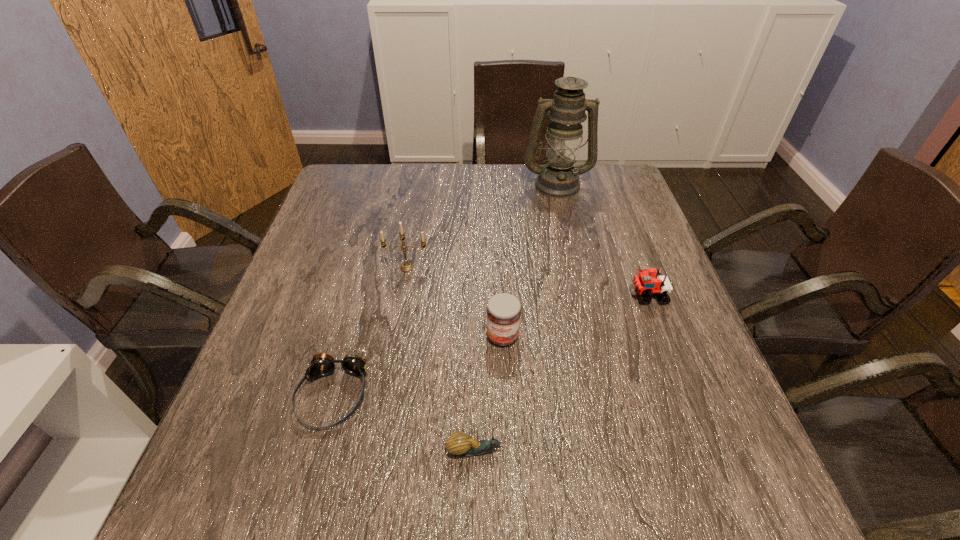
Find the location of `oil lamp located at the right edge`. oil lamp located at the right edge is located at coordinates (559, 178).

Locate an element on the screen. Image resolution: width=960 pixels, height=540 pixels. Lego at the right edge is located at coordinates (644, 284).

Image resolution: width=960 pixels, height=540 pixels. What are the coordinates of `object that is at the far right corner` in the screenshot? It's located at (559, 178).

Image resolution: width=960 pixels, height=540 pixels. In the image, there is a desktop. Find the location of `vacant area at the far edge`. vacant area at the far edge is located at coordinates (519, 200).

The height and width of the screenshot is (540, 960). I want to click on vacant space at the near edge of the desktop, so click(335, 480).

Where is `vacant space at the left edge of the desktop`? vacant space at the left edge of the desktop is located at coordinates pyautogui.click(x=321, y=251).

Identify the location of free space at the right edge. This screenshot has width=960, height=540. (648, 319).

Where is `vacant space at the far left corner`? The width and height of the screenshot is (960, 540). vacant space at the far left corner is located at coordinates (332, 188).

Find the location of a particular element. free spot between the candle and the fourth tallest object is located at coordinates (527, 281).

Where is `free space between the third farthest object and the nearest object`? free space between the third farthest object and the nearest object is located at coordinates (562, 373).